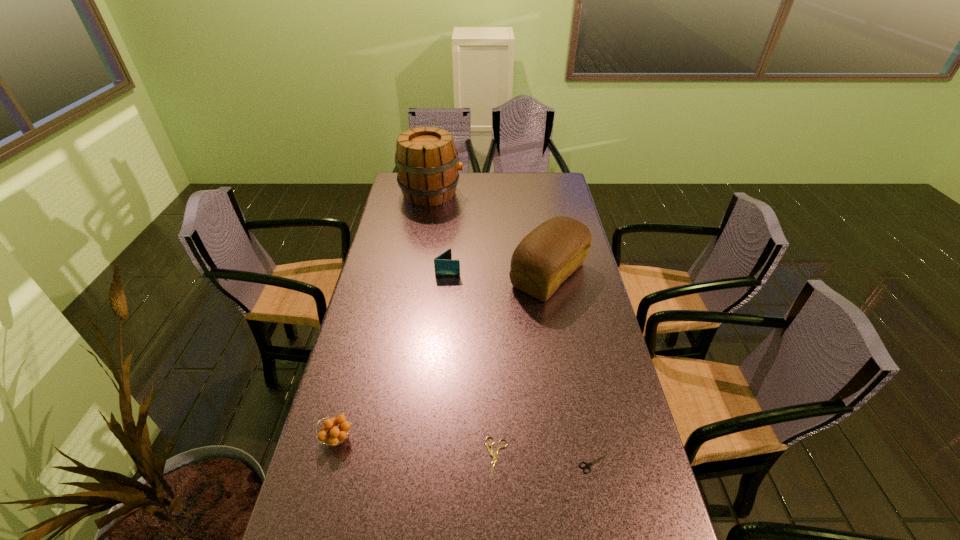
Find the location of a particular element. vacant space in between the right shears and the third object from right to left is located at coordinates (545, 461).

Where is `vacant region between the third tallest object and the tallest object`? The height and width of the screenshot is (540, 960). vacant region between the third tallest object and the tallest object is located at coordinates coord(440,232).

This screenshot has width=960, height=540. What are the coordinates of `the fifth closest object relative to the right shears` in the screenshot? It's located at pos(427,163).

Find the location of a particular element. The height and width of the screenshot is (540, 960). the fifth closest object relative to the orange fruit is located at coordinates click(427, 163).

Find the location of a particular element. blank space that satisfies the following two spatial constraints: 1. on the side of the right shears where the spigot is located; 2. on the right side of the farthest object is located at coordinates (388, 464).

I want to click on free space in the image that satisfies the following two spatial constraints: 1. on the back side of the left shears; 2. on the side of the tallest object where the spigot is located, so click(x=489, y=193).

At what (x,y) coordinates should I click in order to perform the action: click on blank space that satisfies the following two spatial constraints: 1. on the side of the cider where the spigot is located; 2. on the back side of the bread. Please return your answer as a coordinate pair (x, y). This screenshot has height=540, width=960. Looking at the image, I should click on (418, 275).

Where is `free space that satisfies the following two spatial constraints: 1. on the exterior surface of the third tallest object; 2. on the left side of the bread`? free space that satisfies the following two spatial constraints: 1. on the exterior surface of the third tallest object; 2. on the left side of the bread is located at coordinates (447, 275).

Image resolution: width=960 pixels, height=540 pixels. I want to click on vacant position in the image that satisfies the following two spatial constraints: 1. on the back side of the bread; 2. on the left side of the third shortest object, so 380,275.

Locate an element on the screen. vacant region that satisfies the following two spatial constraints: 1. on the side of the left shears where the spigot is located; 2. on the right side of the tallest object is located at coordinates (389, 457).